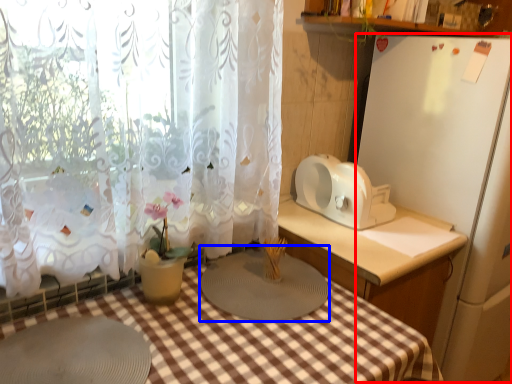
Question: Which object is closer to the camera taking this photo, appliance (highlighted by a red box) or appliance (highlighted by a blue box)?

Choices:
 (A) appliance
 (B) appliance

Answer: (B)